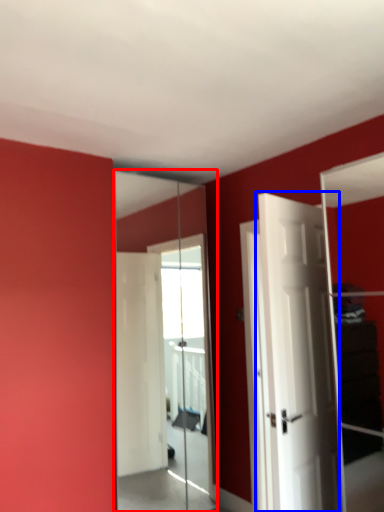
Question: Which point is closer to the camera, mirror (highlighted by a red box) or door (highlighted by a blue box)?

Choices:
 (A) mirror
 (B) door

Answer: (B)